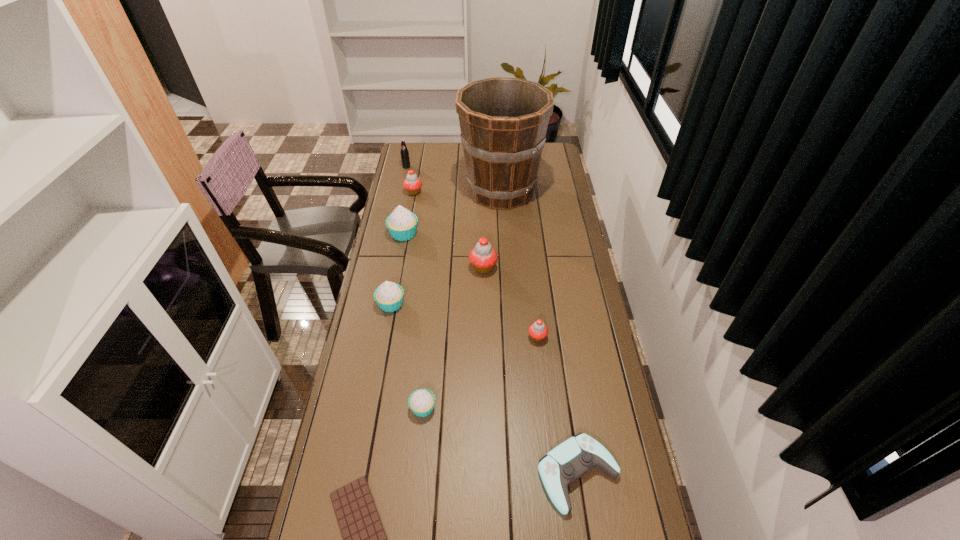
The height and width of the screenshot is (540, 960). I want to click on bucket, so click(503, 121).

Locate an element on the screen. pop is located at coordinates (405, 159).

The height and width of the screenshot is (540, 960). What are the coordinates of `the third farthest cupcake` in the screenshot? It's located at (483, 257).

This screenshot has width=960, height=540. In order to click on the biggest red cupcake in this screenshot , I will do `click(483, 257)`.

You are a GUI agent. You are given a task and a screenshot of the screen. Output one action in this format:
    pyautogui.click(x=<x>, y=<y>)
    Task: Click on the farthest white cupcake
    
    Given the screenshot: What is the action you would take?
    pyautogui.click(x=402, y=224)

Where is `the fourth farthest object`? the fourth farthest object is located at coordinates (402, 224).

Identify the location of the second nearest white cupcake. (389, 296).

Locate an element on the screen. Image resolution: width=960 pixels, height=540 pixels. the fourth farthest cupcake is located at coordinates (389, 296).

Where is `the second biggest red cupcake`? The height and width of the screenshot is (540, 960). the second biggest red cupcake is located at coordinates (412, 184).

This screenshot has width=960, height=540. I want to click on the farthest cupcake, so click(412, 184).